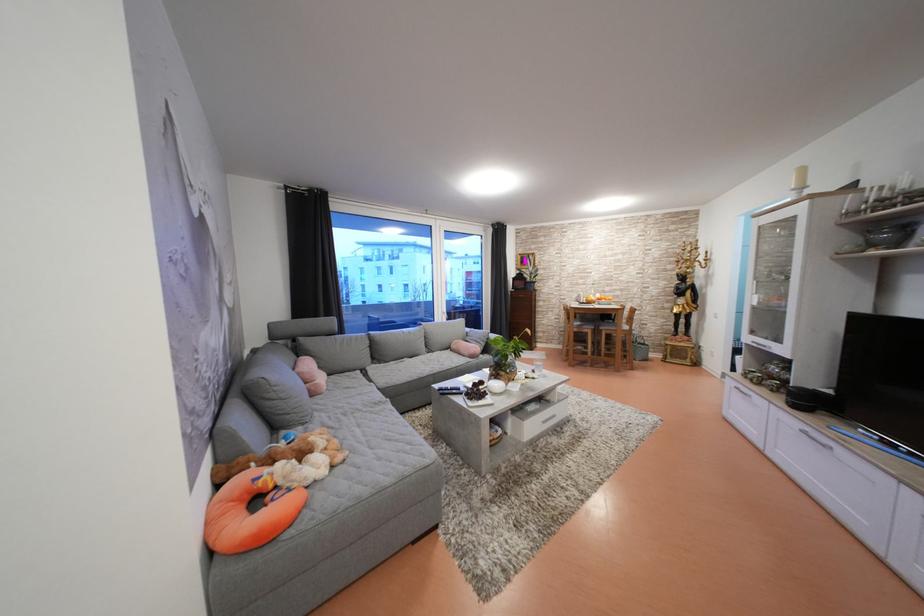
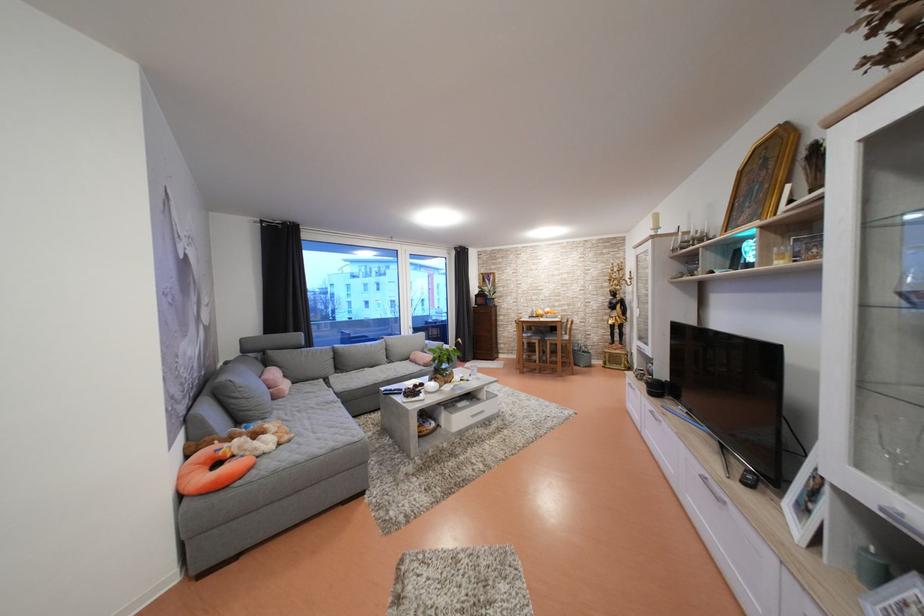
In the second image, find the point that corresponds to [809,193] in the first image.

(664, 233)